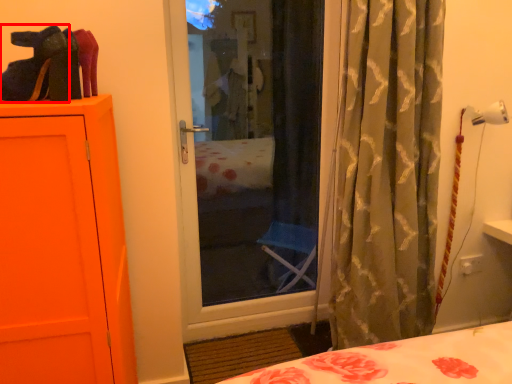
Question: Observing the image, what is the correct spatial positioning of shoe (annotated by the red box) in reference to curtain?

Choices:
 (A) left
 (B) right

Answer: (A)